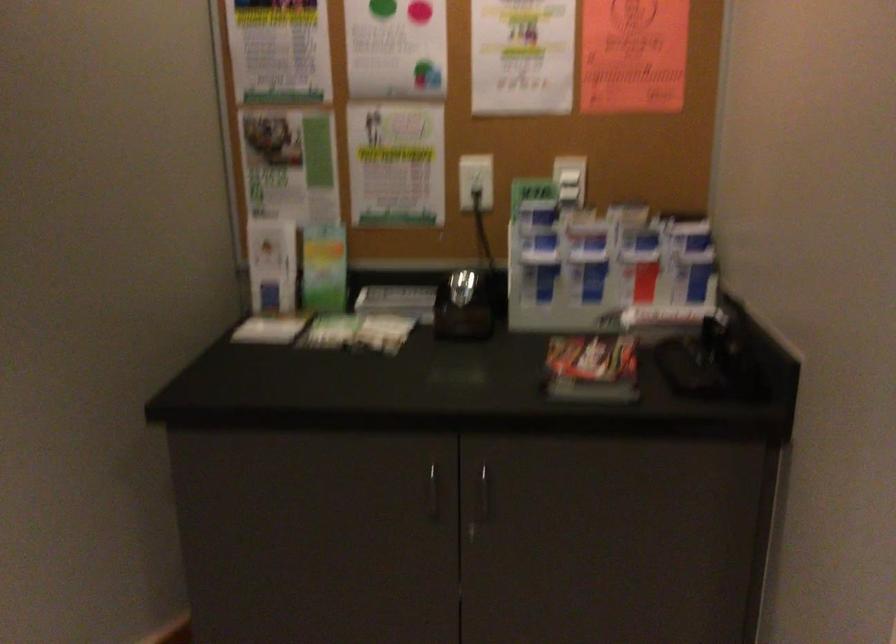
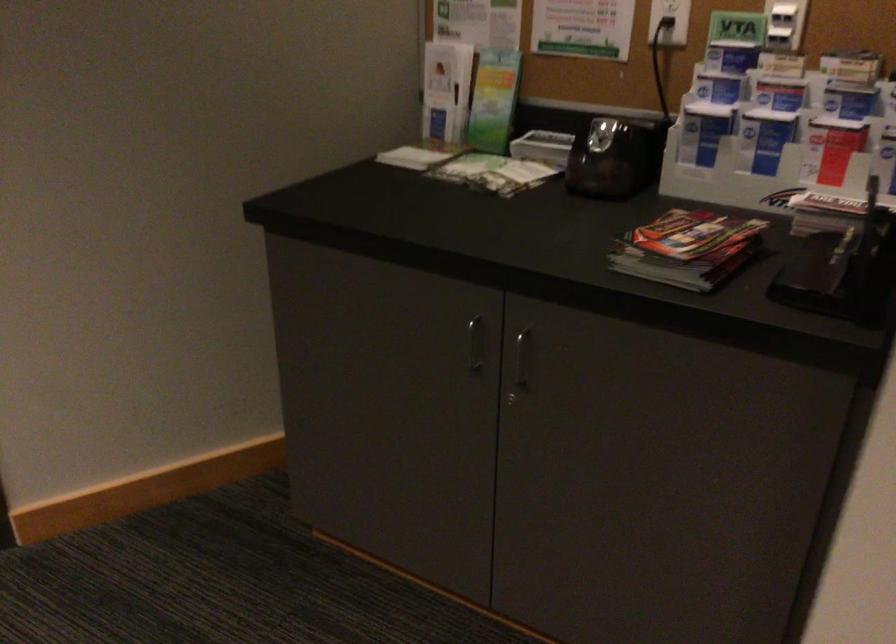
Where in the second image is the point corresponding to (421,491) from the first image?

(475, 343)